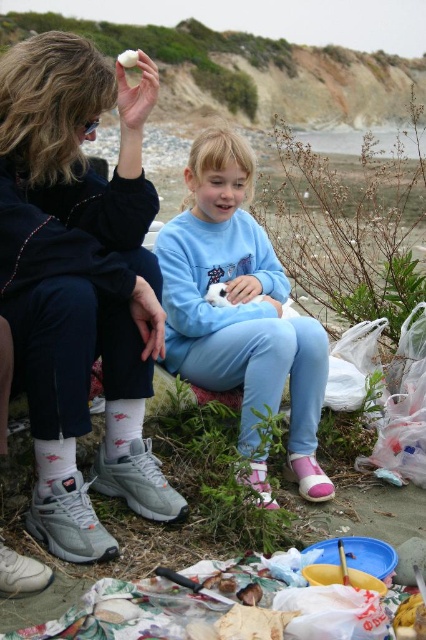
Question: Does matte black sneakers at left lie behind white fur cat at center?

Choices:
 (A) yes
 (B) no

Answer: (B)

Question: Estimate the real-world distances between objects in this image. Which object is closer to the matte black sneakers at left?

Choices:
 (A) white cotton sock at lower center
 (B) white fur cat at center
 (C) white cotton sock at lower left
 (D) light blue fleece sweatshirt at center

Answer: (A)

Question: Is matte black sneakers at left above light blue fleece sweatshirt at center?

Choices:
 (A) no
 (B) yes

Answer: (B)

Question: Is matte black sneakers at left below white fur cat at center?

Choices:
 (A) yes
 (B) no

Answer: (B)

Question: Which object appears farthest from the camera in this image?

Choices:
 (A) white fur cat at center
 (B) white cotton sock at lower left
 (C) white cotton sock at lower center

Answer: (A)

Question: Estimate the real-world distances between objects in this image. Which object is closer to the matte black sneakers at left?

Choices:
 (A) white cotton sock at lower center
 (B) white cotton sock at lower left
 (C) white fur cat at center

Answer: (A)